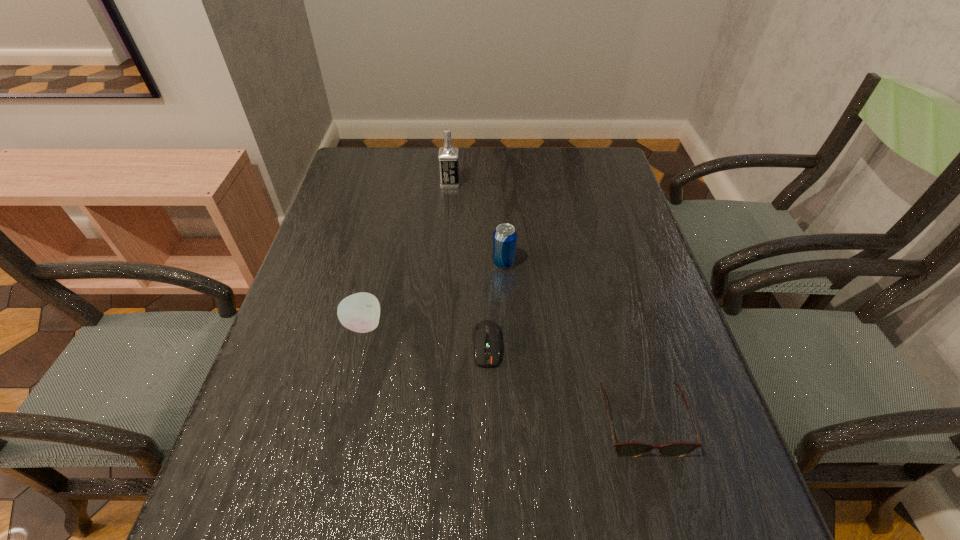
Identify the location of vacant space at the right edge. The height and width of the screenshot is (540, 960). (695, 364).

You are a GUI agent. You are given a task and a screenshot of the screen. Output one action in this format:
    pyautogui.click(x=<x>, y=<y>)
    Task: Click on the vacant space at the far right corner of the desktop
    
    Given the screenshot: What is the action you would take?
    pyautogui.click(x=592, y=170)

Locate an element on the screen. The image size is (960, 540). free space between the fourth shortest object and the second shortest object is located at coordinates (572, 342).

The height and width of the screenshot is (540, 960). I want to click on unoccupied position between the second tallest object and the rightmost object, so click(x=572, y=342).

I want to click on free spot between the computer equipment and the vodka, so click(468, 264).

Where is `free space between the apple and the second tallest object`? The width and height of the screenshot is (960, 540). free space between the apple and the second tallest object is located at coordinates (434, 294).

Locate an element on the screen. The height and width of the screenshot is (540, 960). empty location between the apple and the tallest object is located at coordinates (407, 254).

Where is `free space that is in between the second shortest object and the third shortest object`? The image size is (960, 540). free space that is in between the second shortest object and the third shortest object is located at coordinates (502, 374).

The height and width of the screenshot is (540, 960). I want to click on free space between the second object from left to right and the computer equipment, so click(x=468, y=264).

Find the location of `vacant space in between the beer can and the third tallest object`. vacant space in between the beer can and the third tallest object is located at coordinates (434, 294).